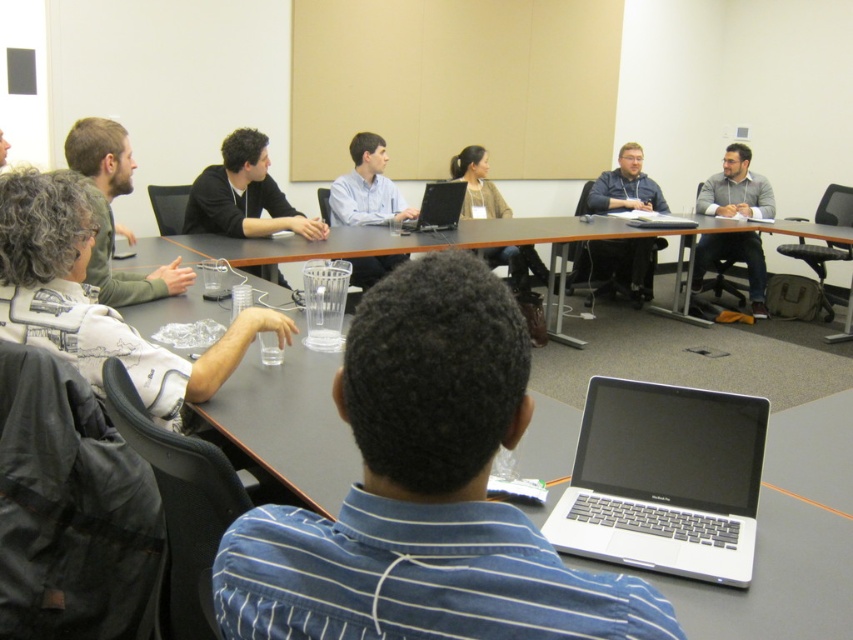
Does silver/black laptop at center appear on the left side of matte black laptop at center?

Incorrect, silver/black laptop at center is not on the left side of matte black laptop at center.

Measure the distance between silver/black laptop at center and camera.

silver/black laptop at center is 1.16 meters from camera.

Is point (596, 522) closer to viewer compared to point (490, 186)?

Yes, it is in front of point (490, 186).

Locate an element on the screen. silver/black laptop at center is located at coordinates (664, 481).

Between point (103, 196) and point (386, 260), which one is positioned behind?

Positioned behind is point (386, 260).

Does point (108, 161) lie in front of point (368, 161)?

Yes, it is in front of point (368, 161).

Which is behind, point (107, 202) or point (376, 154)?

Positioned behind is point (376, 154).

Locate an element on the screen. dark brown hair at upper left is located at coordinates click(112, 214).

Does blue striped shirt at center have a greater width compared to light brown leather jacket at left?

No.

Is point (393, 340) behind point (21, 188)?

No, (393, 340) is closer to viewer.

This screenshot has width=853, height=640. I want to click on blue striped shirt at center, so click(x=424, y=493).